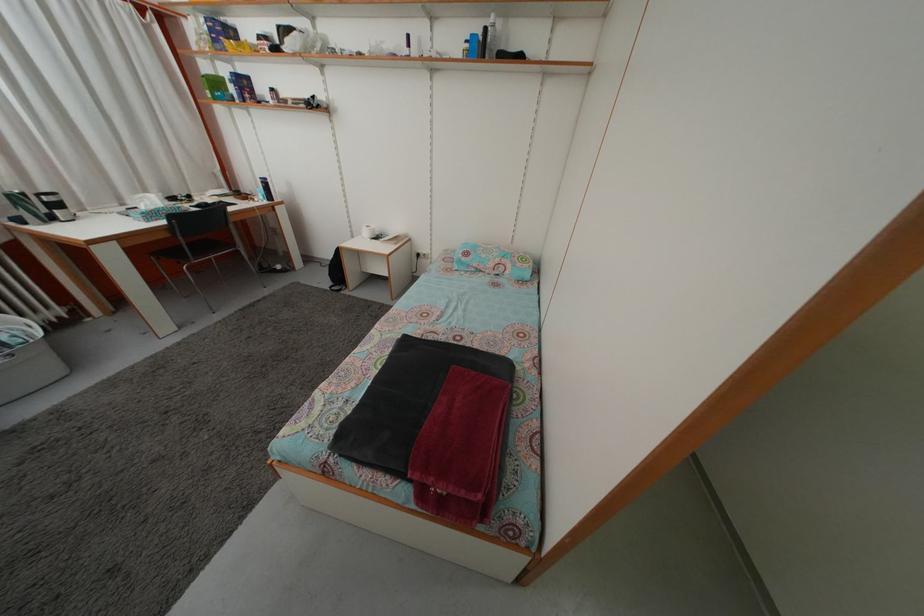
Image resolution: width=924 pixels, height=616 pixels. In order to click on clear plastic bottle in this screenshot , I will do `click(265, 188)`.